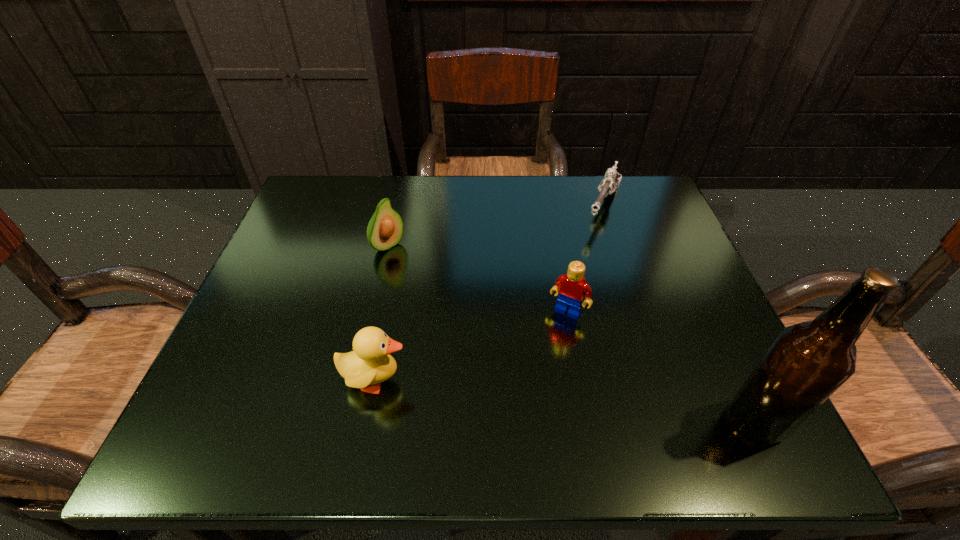
Identify the location of vacant area at the far right corner. This screenshot has width=960, height=540. (656, 198).

Image resolution: width=960 pixels, height=540 pixels. I want to click on free space between the duckling and the shortest object, so click(x=490, y=293).

The image size is (960, 540). Find the location of `vacant area between the third nearest object and the duckling`. vacant area between the third nearest object and the duckling is located at coordinates (472, 346).

The width and height of the screenshot is (960, 540). Identify the location of vacant area that lies between the duckling and the rightmost object. (565, 400).

The width and height of the screenshot is (960, 540). What are the coordinates of `free space between the rightmost object and the second object from right to left` in the screenshot? It's located at (680, 313).

The width and height of the screenshot is (960, 540). Identify the location of free area in between the duckling and the second farthest object. (382, 313).

The image size is (960, 540). In order to click on vacant region between the fourth nearest object and the duckling in this screenshot , I will do `click(382, 313)`.

Where is `empty space between the third object from left to right and the rightmost object`? empty space between the third object from left to right and the rightmost object is located at coordinates (662, 366).

Find the location of a particular element. This screenshot has width=960, height=540. vacant region between the Lego and the second farthest object is located at coordinates (478, 279).

The width and height of the screenshot is (960, 540). What are the coordinates of `free area in between the farthest object and the Lego` in the screenshot? It's located at (587, 259).